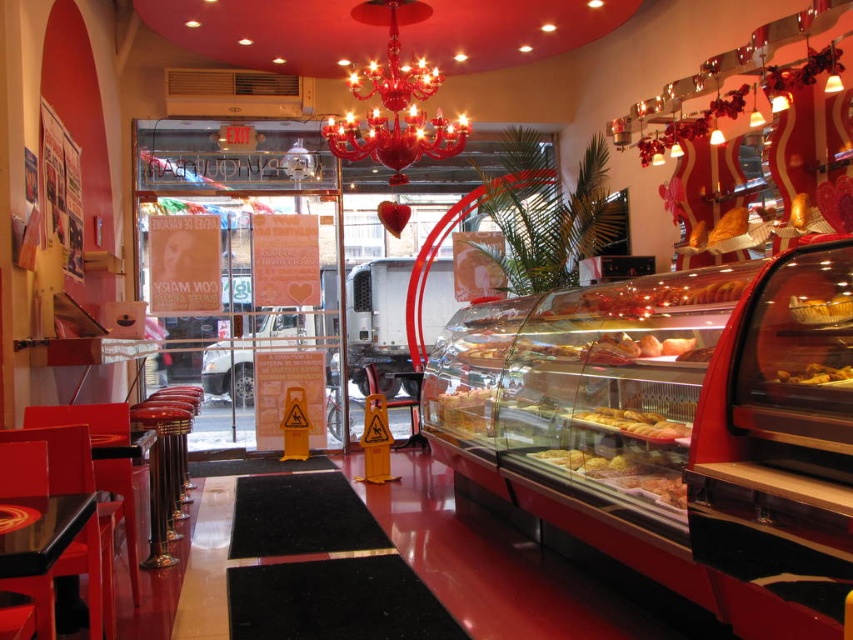
Question: Is shiny glass chandelier at center wider than golden crispy pastry at center?

Choices:
 (A) no
 (B) yes

Answer: (B)

Question: Which point is closer to the camera?

Choices:
 (A) (606, 422)
 (B) (850, 378)
 (C) (850, 305)

Answer: (B)

Question: Which of the following is the closest to the observer?

Choices:
 (A) golden brown crusty bread at center
 (B) shiny glass chandelier at center
 (C) golden crispy pastry at center
 (D) golden glazed pastry at center

Answer: (C)

Question: Is golden brown crusty bread at center above golden glazed pastry at center?

Choices:
 (A) yes
 (B) no

Answer: (B)

Question: Is shiny glass chandelier at center to the left of golden glazed pastry at center from the viewer's perspective?

Choices:
 (A) no
 (B) yes

Answer: (B)

Question: Which object appears farthest from the camera in this image?

Choices:
 (A) golden glazed pastry at center
 (B) golden crispy pastry at center

Answer: (A)